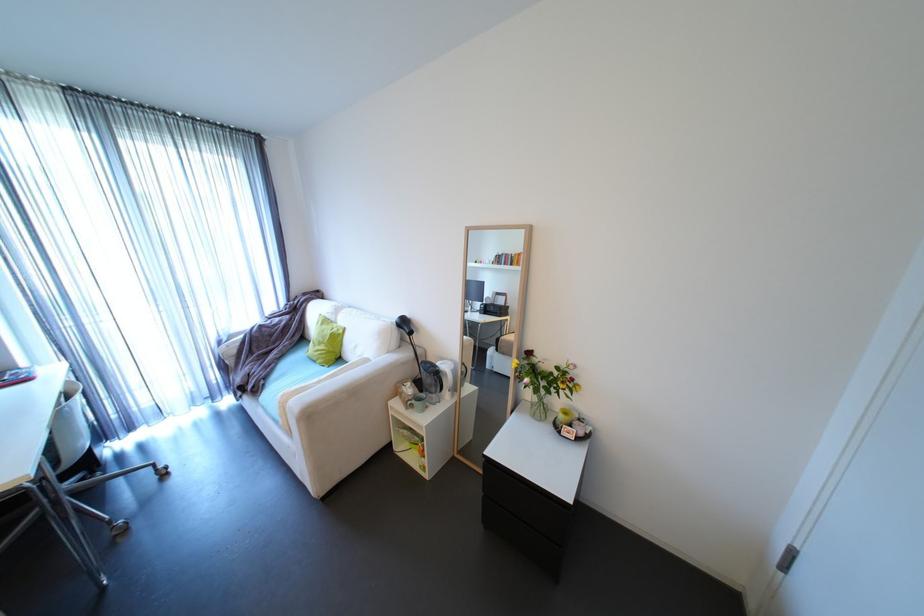
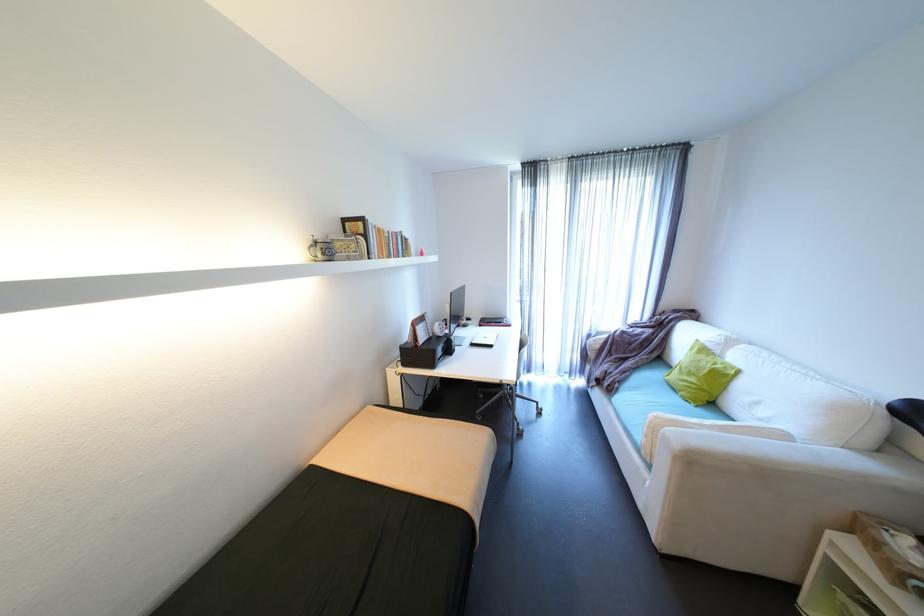
Find the pixel in the second image that matches the point at 410,363 in the first image.

(907, 493)